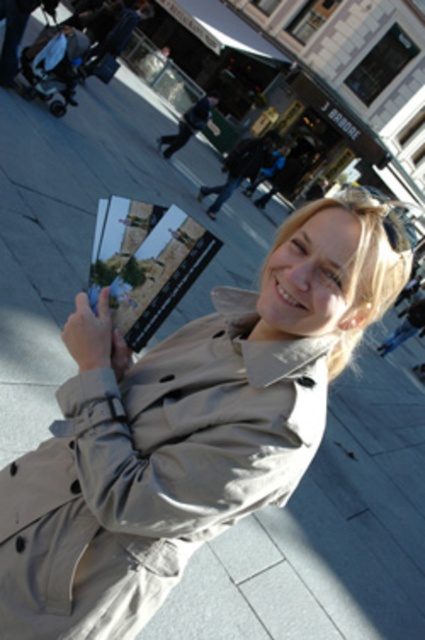
Which of these two, light beige trench coat at center or matte gray phone at lower left, stands shorter?

With less height is matte gray phone at lower left.

Does light beige trench coat at center have a lesser width compared to matte gray phone at lower left?

Incorrect, light beige trench coat at center's width is not less than matte gray phone at lower left's.

Who is more distant from viewer, (47, 497) or (116, 369)?

The point (116, 369) is more distant.

Find the location of a particular element. The height and width of the screenshot is (640, 425). light beige trench coat at center is located at coordinates (153, 472).